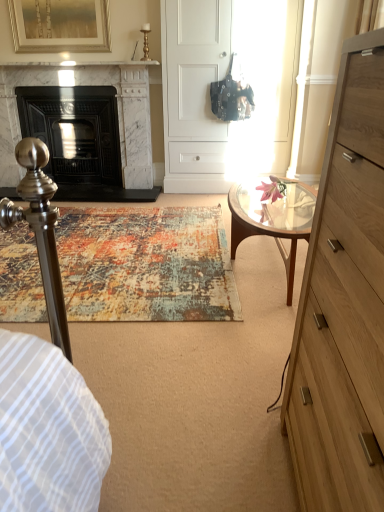
Question: From the image's perspective, is matte black fireplace at left, which is counted as the first fireplace, starting from the left, positioned above or below light brown wood chest of drawers at right?

Choices:
 (A) below
 (B) above

Answer: (B)

Question: Considering the positions of point (69, 112) and point (345, 324), is point (69, 112) closer or farther from the camera than point (345, 324)?

Choices:
 (A) closer
 (B) farther

Answer: (B)

Question: Which of these objects is positioned closest to the clear glass coffee table at center?

Choices:
 (A) gold-framed artwork at upper left
 (B) white marble fireplace at left, which is the 2th fireplace from left to right
 (C) light brown wood chest of drawers at right
 (D) matte black fireplace at left, which is counted as the first fireplace, starting from the left

Answer: (C)

Question: Which of these objects is positioned farthest from the matte black fireplace at left, which is counted as the first fireplace, starting from the left?

Choices:
 (A) light brown wood chest of drawers at right
 (B) clear glass coffee table at center
 (C) gold-framed artwork at upper left
 (D) white marble fireplace at left, which is the 2th fireplace from left to right

Answer: (A)